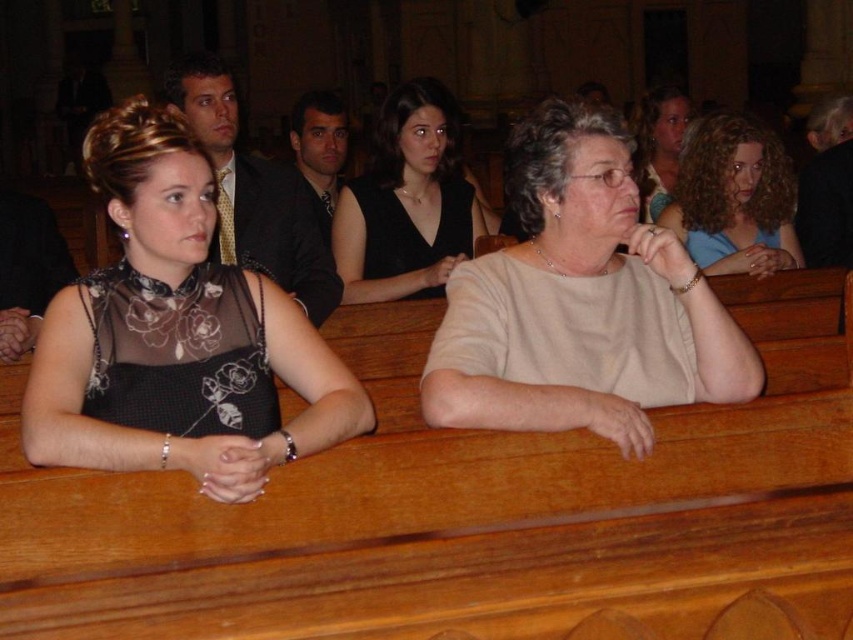
You are an event planner arranging a photo shoot in this church setting. You need to position a small podium between the matte gold tie at upper left and the matte black dress at upper center. Based on their positions, where should the podium be placed relative to these two objects?

The podium should be placed below the matte black dress at upper center and above the matte gold tie at upper left since the matte gold tie at upper left is below the matte black dress at upper center.

You are organizing a photo shoot and need to ensure that all accessories are proportional to the outfits. Given the scene described, does the matte gold tie at upper left appear appropriately sized relative to the matte black dress at upper center?

The matte gold tie at upper left has a larger size compared to the matte black dress at upper center, so it may not appear appropriately sized as the tie is significantly larger than the dress.

You are an event planner arranging seating for a ceremony. You need to ensure there is enough space between the curly hair at upper right and the dark brown hair at center. Based on the image, can you determine if the space between them is sufficient for placing a 30 cm wide decorative item?

The curly hair at upper right might be wider than dark brown hair at center, so there might be enough space to place a 30 cm wide decorative item between them.